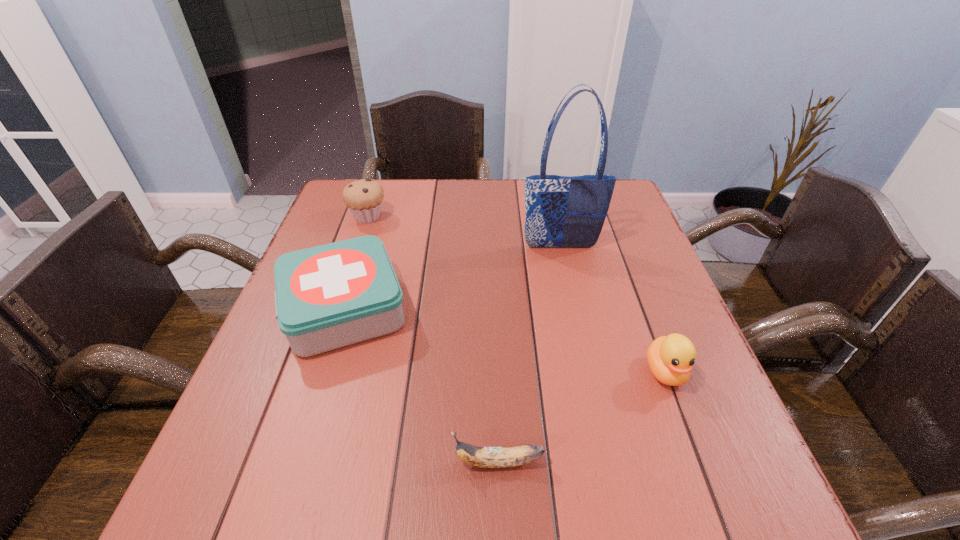
This screenshot has width=960, height=540. I want to click on object located in the far left corner section of the desktop, so click(364, 198).

Find the location of a particular element. This screenshot has width=960, height=540. free spot at the far edge of the desktop is located at coordinates (394, 201).

The height and width of the screenshot is (540, 960). I want to click on free space at the near edge of the desktop, so click(x=443, y=505).

At what (x,y) coordinates should I click in order to perform the action: click on free region at the left edge. Please return your answer as a coordinate pair (x, y). This screenshot has width=960, height=540. Looking at the image, I should click on (288, 389).

You are a GUI agent. You are given a task and a screenshot of the screen. Output one action in this format:
    pyautogui.click(x=<x>, y=<y>)
    Task: Click on the free space at the right edge of the desktop
    This screenshot has height=540, width=960.
    Given the screenshot: What is the action you would take?
    pyautogui.click(x=627, y=277)

In the image, there is a desktop. Identify the location of vacant space at the far left corner. The height and width of the screenshot is (540, 960). click(x=356, y=180).

Find the location of `free region at the far right corner`. free region at the far right corner is located at coordinates (623, 211).

In the image, there is a desktop. At what (x,y) coordinates should I click in order to perform the action: click on free region at the near right corner. Please return your answer as a coordinate pair (x, y). The image size is (960, 540). Looking at the image, I should click on (767, 523).

The width and height of the screenshot is (960, 540). What are the coordinates of `free space between the first-aid kit and the duckling` in the screenshot? It's located at (505, 341).

Identify the location of free space between the fourth nearest object and the rightmost object. This screenshot has width=960, height=540. (612, 309).